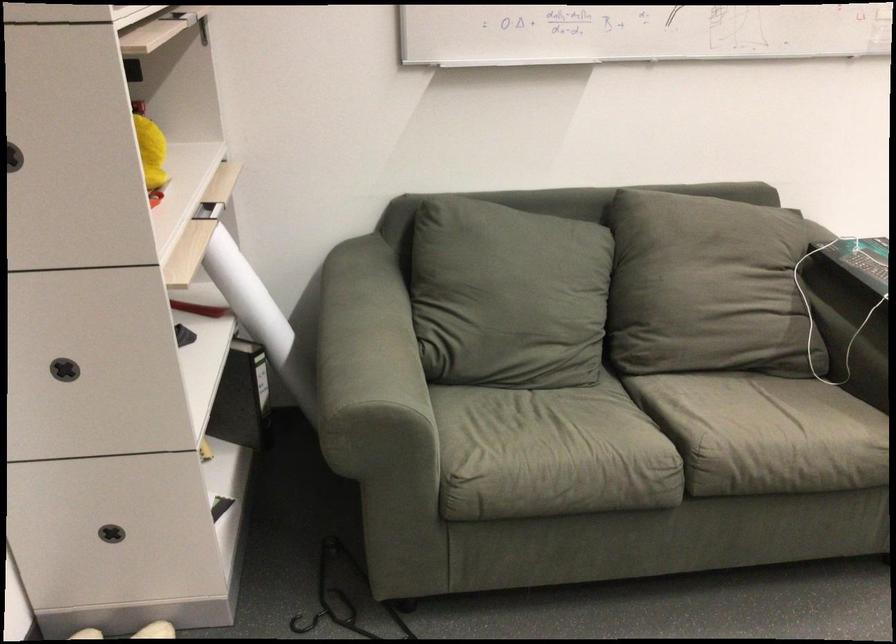
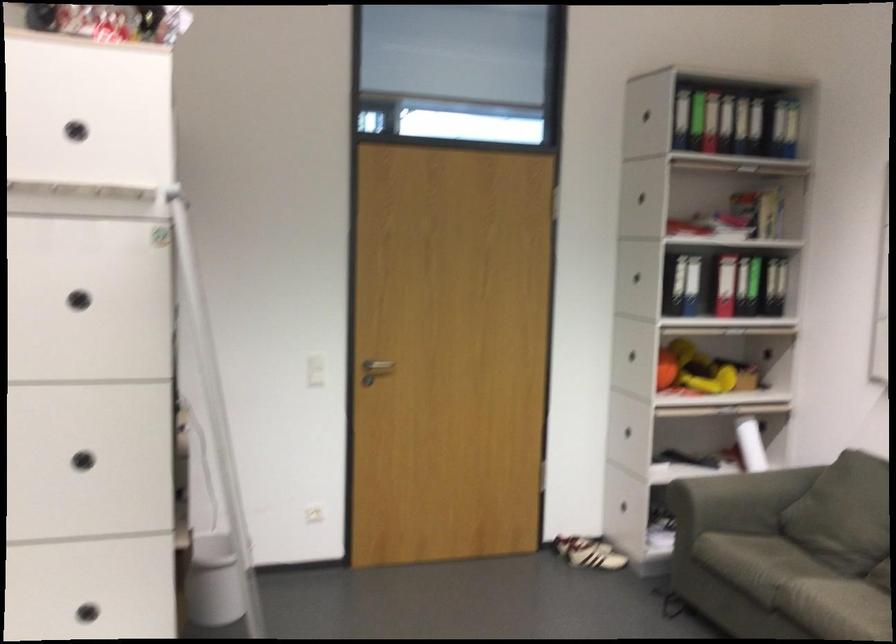
Locate, in the second image, the point that corresponds to point (712, 406) in the first image.

(832, 592)